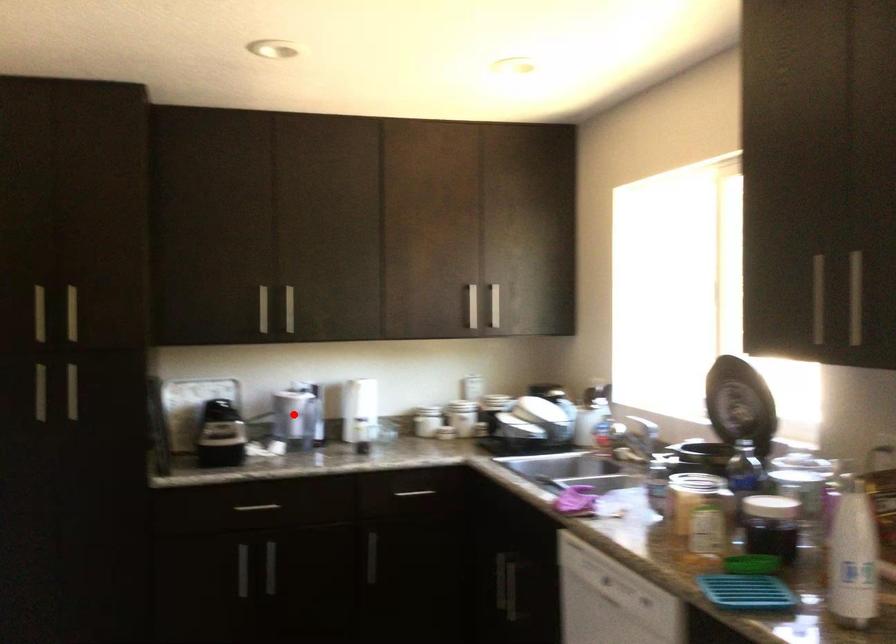
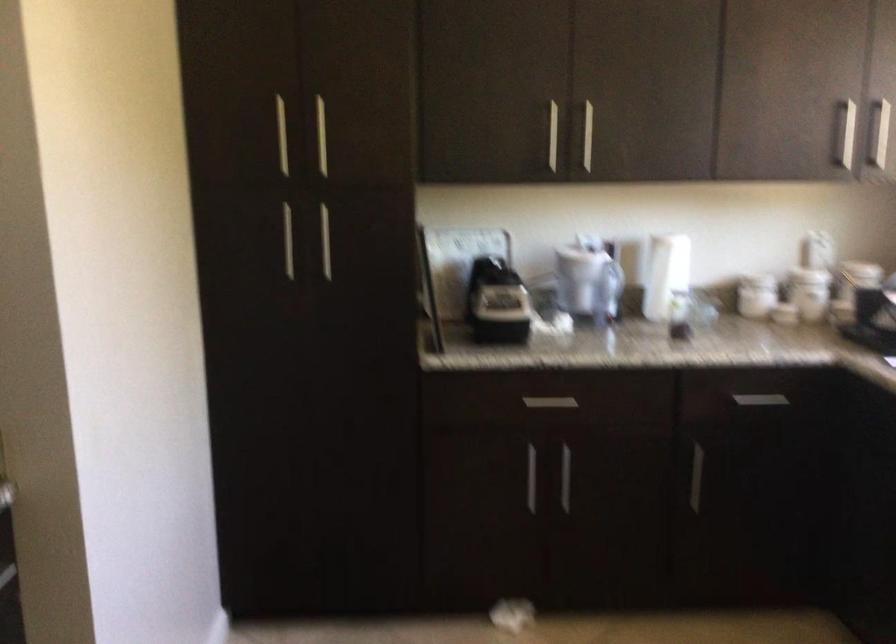
Question: I am providing you with two images of the same scene from different viewpoints. Given a red point in image1, look at the same physical point in image2. Is it:

Choices:
 (A) Closer to the viewpoint
 (B) Farther from the viewpoint

Answer: (A)